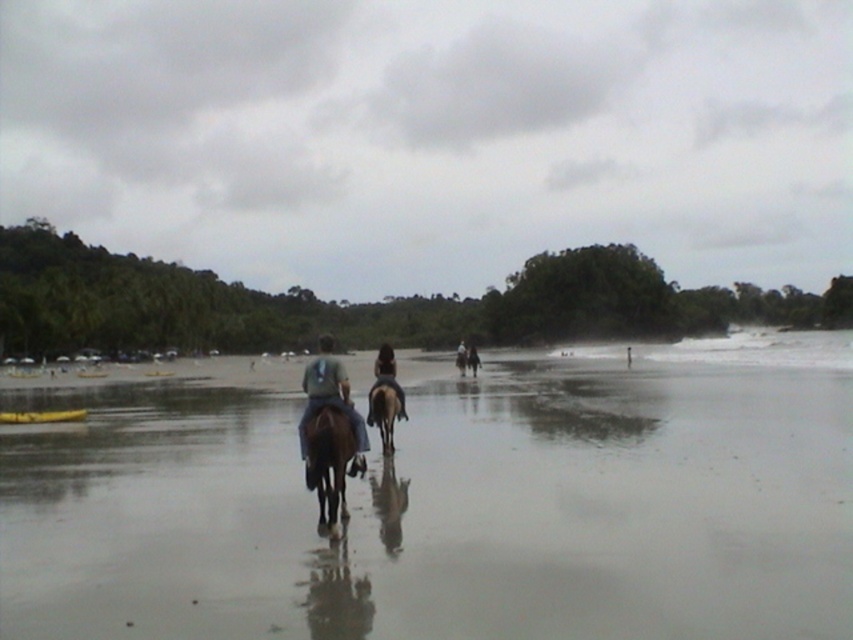
Question: Where is shiny wet sand at center located in relation to smooth brown horse at center in the image?

Choices:
 (A) right
 (B) left

Answer: (B)

Question: Can you confirm if blue denim jeans at center is positioned above dark brown leather jacket at center?

Choices:
 (A) yes
 (B) no

Answer: (A)

Question: Among these points, which one is nearest to the camera?

Choices:
 (A) (328, 481)
 (B) (390, 419)

Answer: (A)

Question: Which of the following is the closest to the observer?

Choices:
 (A) dark brown leather horse at center
 (B) dark brown leather jacket at center
 (C) brown glossy horse at center
 (D) blue denim jeans at center

Answer: (D)

Question: Is shiny wet sand at center below brown glossy horse at center?

Choices:
 (A) no
 (B) yes

Answer: (B)

Question: Considering the real-world distances, which object is farthest from the dark brown leather horse at center?

Choices:
 (A) smooth brown horse at center
 (B) brown glossy horse at center
 (C) shiny wet sand at center

Answer: (A)